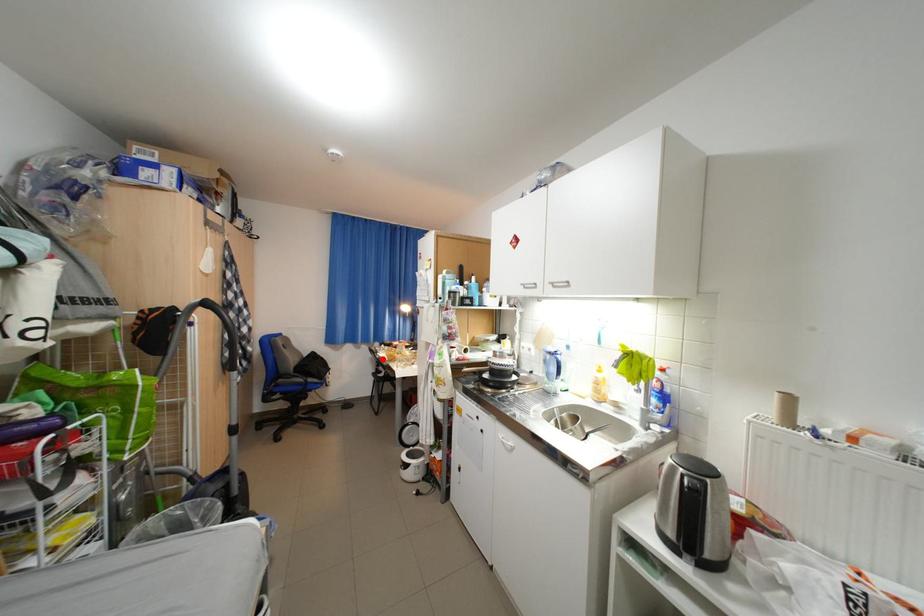
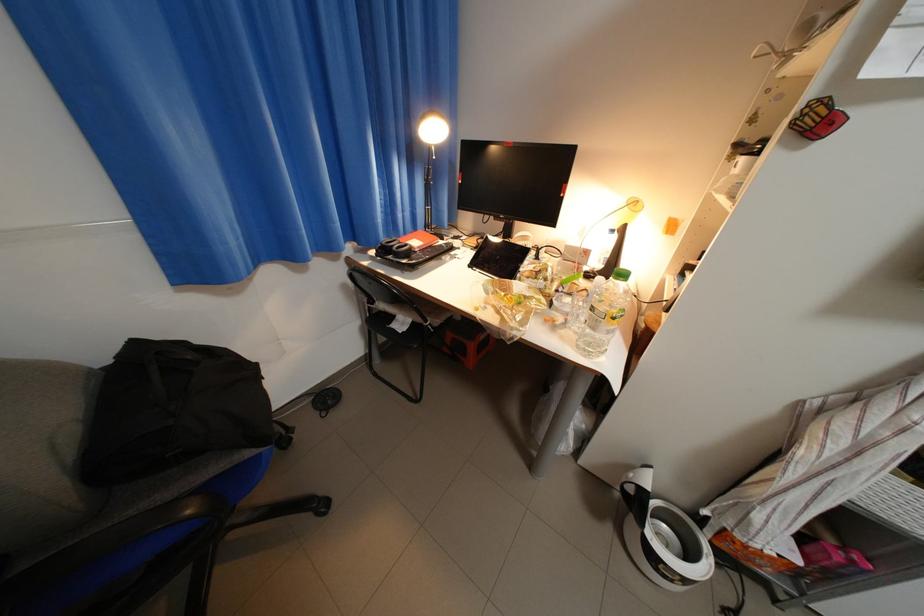
The point at the highlighted location is marked in the first image. Where is the corresponding point in the second image?

(355, 286)